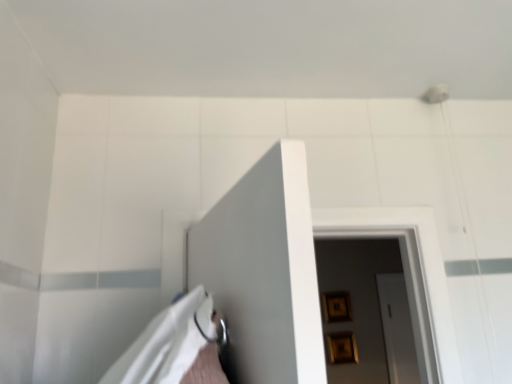
Question: Considering the positions of wooden picture frame at center, positioned as the 2th picture frame in top-to-bottom order, and gold metallic picture frame at upper center, the 1th picture frame from the top, in the image, is wooden picture frame at center, positioned as the 2th picture frame in top-to-bottom order, taller or shorter than gold metallic picture frame at upper center, the 1th picture frame from the top,?

Choices:
 (A) tall
 (B) short

Answer: (B)

Question: Would you say wooden picture frame at center, the 1th picture frame in the bottom-to-top sequence, is inside or outside gold metallic picture frame at upper center, the 1th picture frame from the top?

Choices:
 (A) outside
 (B) inside

Answer: (A)

Question: From a real-world perspective, is wooden picture frame at center, positioned as the 2th picture frame in top-to-bottom order, above or below gold metallic picture frame at upper center, the 2th picture frame positioned from the bottom?

Choices:
 (A) below
 (B) above

Answer: (A)

Question: In terms of width, does gold metallic picture frame at upper center, the 2th picture frame positioned from the bottom, look wider or thinner when compared to wooden picture frame at center, the 1th picture frame in the bottom-to-top sequence?

Choices:
 (A) wide
 (B) thin

Answer: (B)

Question: Considering the positions of gold metallic picture frame at upper center, the 1th picture frame from the top, and wooden picture frame at center, the 1th picture frame in the bottom-to-top sequence, in the image, is gold metallic picture frame at upper center, the 1th picture frame from the top, bigger or smaller than wooden picture frame at center, the 1th picture frame in the bottom-to-top sequence,?

Choices:
 (A) small
 (B) big

Answer: (A)

Question: Considering their positions, is gold metallic picture frame at upper center, the 2th picture frame positioned from the bottom, located in front of or behind wooden picture frame at center, positioned as the 2th picture frame in top-to-bottom order?

Choices:
 (A) front
 (B) behind

Answer: (B)

Question: Based on their positions, is gold metallic picture frame at upper center, the 2th picture frame positioned from the bottom, located to the left or right of wooden picture frame at center, positioned as the 2th picture frame in top-to-bottom order?

Choices:
 (A) left
 (B) right

Answer: (A)